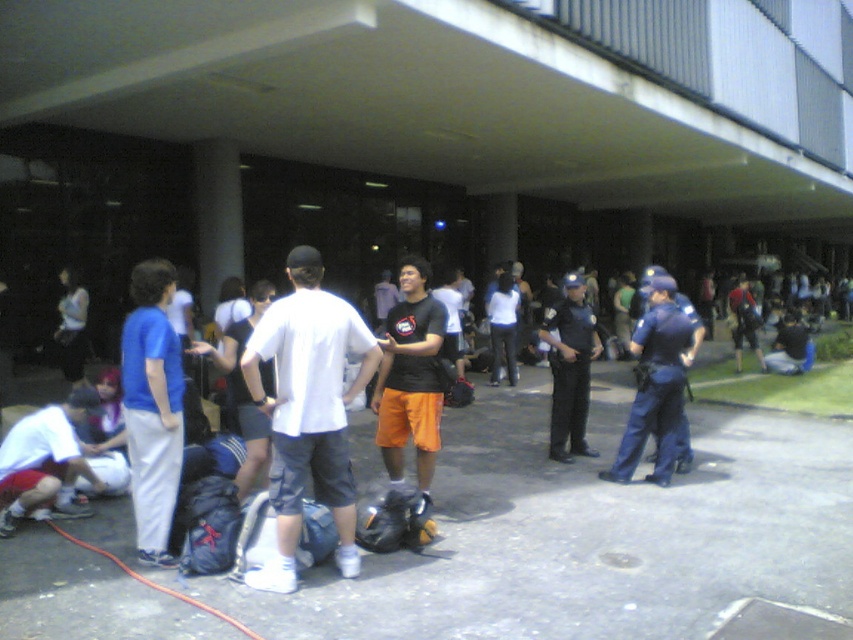
You are standing at the entrance of the building and want to locate two specific points marked in the image. Which of the two points, point 1 at coordinates (285, 323) or point 2 at coordinates (556, 362), is closer to you?

Point 1 at coordinates (285, 323) is closer to the viewer than point 2 at coordinates (556, 362).

You are standing at the point labeled as point (614, 456). You want to move to the entrance of the building. Is the entrance closer to you than 25 feet?

The entrance is 23.49 feet away from point (614, 456), so yes, the entrance is closer than 25 feet.

In the image, there is a person wearing blue uniform pants at center. Can you determine if the blue uniform pants at center are located to the left or right of the point marked at coordinates (654, 385)?

The blue uniform pants at center are represented by the point marked at coordinates (654, 385), so they are exactly at that point and not to the left or right of it.